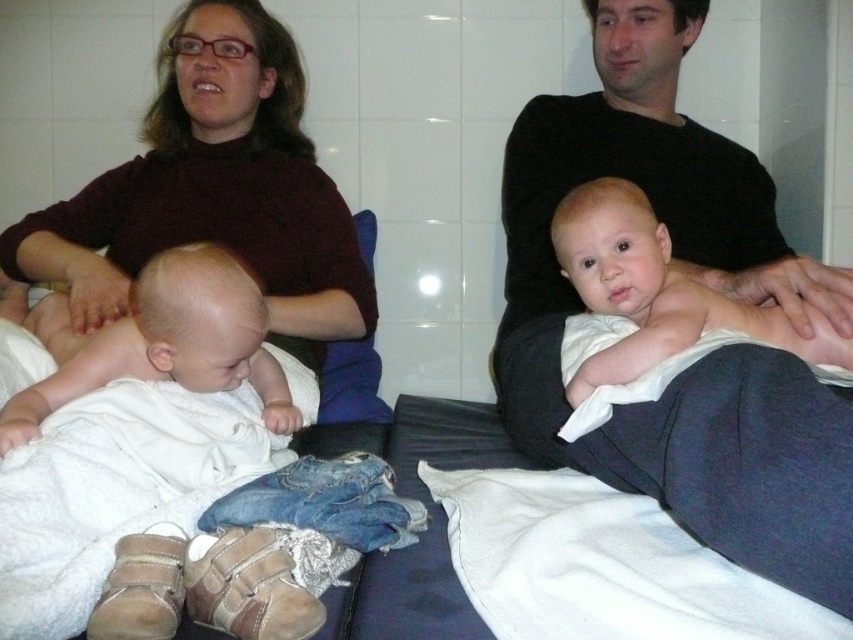
Which is more to the right, black cotton shirt at upper right or matte brown sweater at upper left?

From the viewer's perspective, black cotton shirt at upper right appears more on the right side.

Locate an element on the screen. black cotton shirt at upper right is located at coordinates (699, 280).

Where is `black cotton shirt at upper right`? black cotton shirt at upper right is located at coordinates (699, 280).

Does matte brown sweater at upper left appear on the left side of white clothed baby at upper right?

Correct, you'll find matte brown sweater at upper left to the left of white clothed baby at upper right.

Is the position of matte brown sweater at upper left more distant than that of white clothed baby at upper right?

Yes, it is behind white clothed baby at upper right.

What are the coordinates of `matte brown sweater at upper left` in the screenshot? It's located at (213, 189).

The image size is (853, 640). What are the coordinates of `matte brown sweater at upper left` in the screenshot? It's located at (213, 189).

Can you confirm if black cotton shirt at upper right is smaller than white clothed baby at upper right?

No.

Consider the image. Which of these two, black cotton shirt at upper right or white clothed baby at upper right, stands taller?

black cotton shirt at upper right is taller.

Who is more forward, (737,278) or (627,378)?

Point (627,378) is more forward.

This screenshot has width=853, height=640. In order to click on black cotton shirt at upper right in this screenshot , I will do `click(699, 280)`.